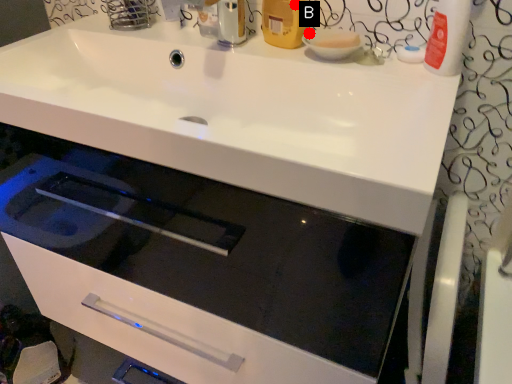
Question: Two points are circled on the image, labeled by A and B beside each circle. Which point appears farthest from the camera in this image?

Choices:
 (A) A is further
 (B) B is further

Answer: (B)